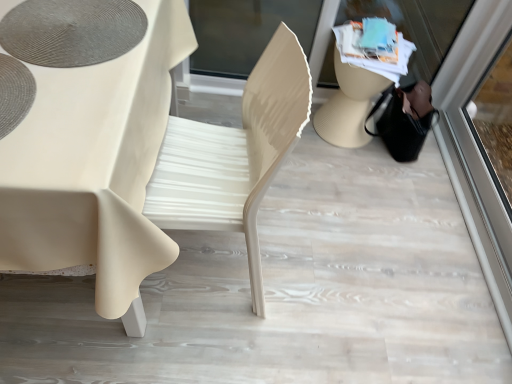
Identify the location of unoccupied region to the right of matte beige chair at center. (322, 259).